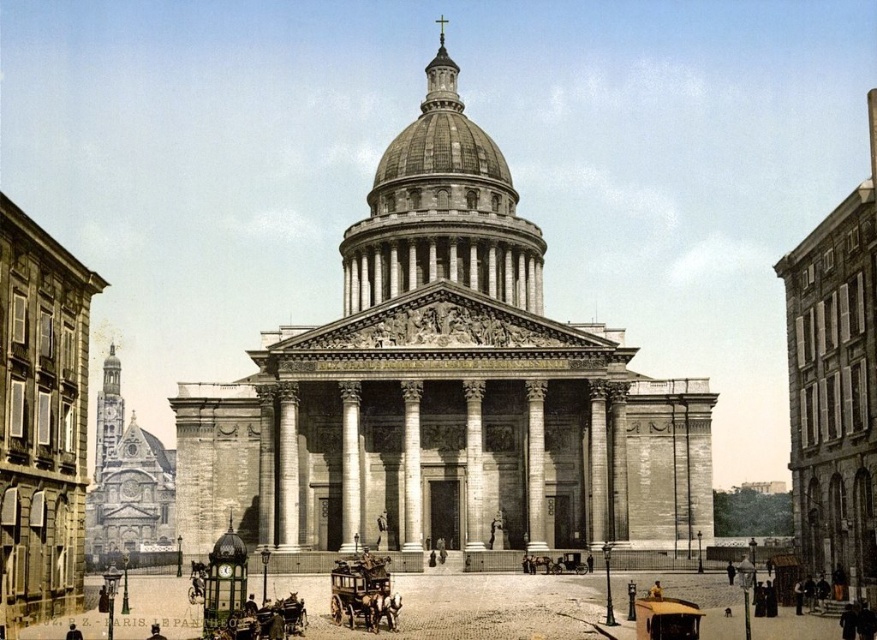
You are standing in front of the Pantheon in Paris and notice the stone cathedral at center and the wooden polished horse cart at center. Which object is taller?

The stone cathedral at center is taller than the wooden polished horse cart at center according to the description provided.

You are standing in front of the Pantheon in Paris, France. You notice two points marked on the facade of the building. The first point is at coordinates point (277, 477) and the second is at point (340, 572). From your perspective, which point is closer to you?

Point (340, 572) is closer to you because it is in front of point (277, 477) according to their spatial arrangement.

You are a tourist standing in front of the Pantheon in Paris. You see the stone cathedral at center and the wooden polished horse cart at center. Which object is larger in size?

The stone cathedral at center is bigger than the wooden polished horse cart at center.